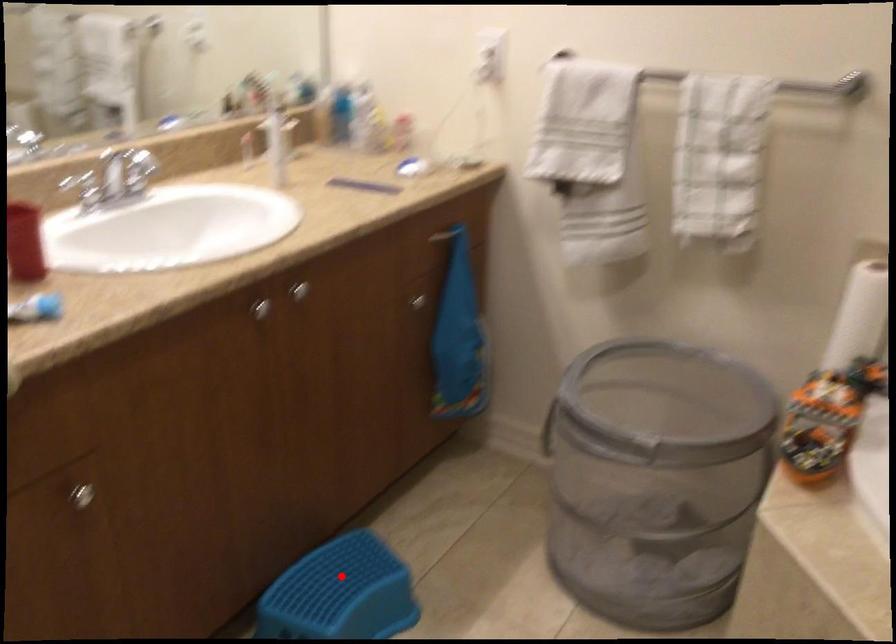
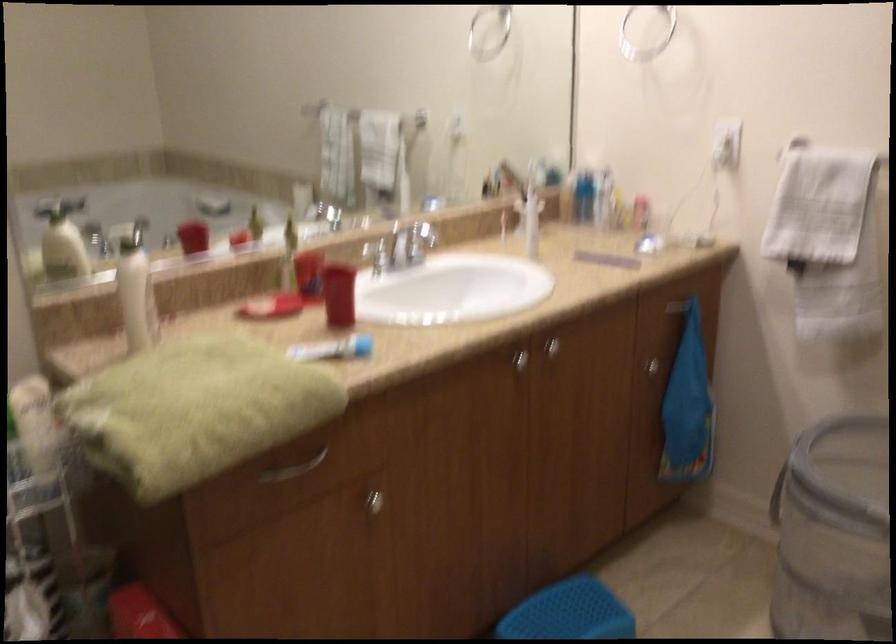
Locate, in the second image, the point that corresponds to the highlighted location in the first image.

(569, 612)